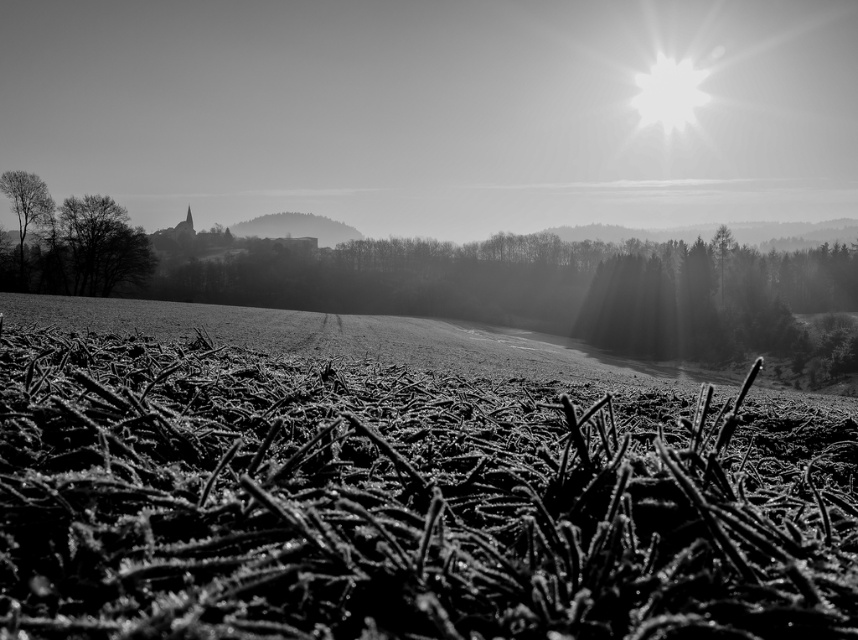
Is point (76, 612) closer to viewer compared to point (3, 182)?

Yes, it is.

Is point (506, 429) farther from viewer compared to point (33, 188)?

No, it is not.

Locate an element on the screen. frosted grass at center is located at coordinates [x=402, y=502].

Is point (450, 593) less distant than point (137, 257)?

Yes, point (450, 593) is in front of point (137, 257).

Is point (666, 612) in front of point (91, 269)?

That is True.

The height and width of the screenshot is (640, 858). I want to click on frosted grass at center, so click(402, 502).

Who is taller, dark textured tree at left or smooth bark tree at left?

Standing taller between the two is dark textured tree at left.

Is dark textured tree at left smaller than smooth bark tree at left?

Actually, dark textured tree at left might be larger than smooth bark tree at left.

Describe the element at coordinates (101, 244) in the screenshot. I see `dark textured tree at left` at that location.

The height and width of the screenshot is (640, 858). In order to click on dark textured tree at left in this screenshot , I will do `click(101, 244)`.